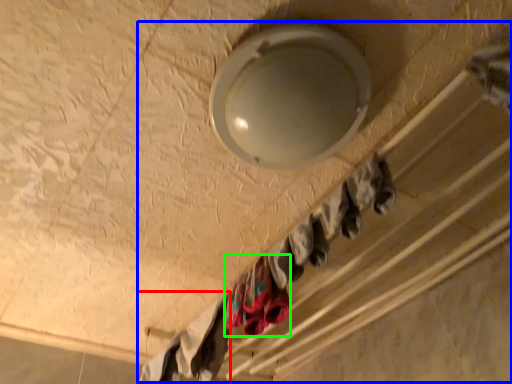
Question: Which is farther away from clothing (highlighted by a red box)? closet (highlighted by a blue box) or clothing (highlighted by a green box)?

Choices:
 (A) closet
 (B) clothing

Answer: (A)